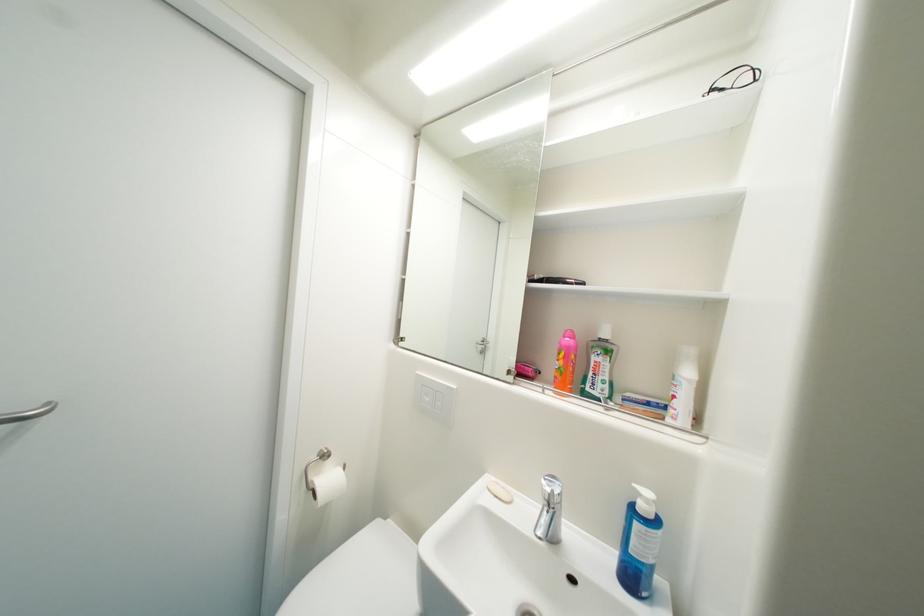
Identify the location of toilet paper roll. (325, 484).